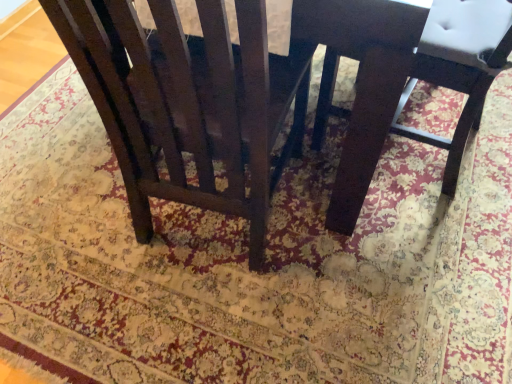
Question: From the image's perspective, is matte dark wood chair at center, marked as the first chair in a right-to-left arrangement, positioned above or below matte dark wood chair at center, positioned as the second chair in right-to-left order?

Choices:
 (A) above
 (B) below

Answer: (A)

Question: Considering the positions of point (345, 165) and point (136, 205), is point (345, 165) closer or farther from the camera than point (136, 205)?

Choices:
 (A) farther
 (B) closer

Answer: (B)

Question: Which object is positioned farthest from the dark wood chair at center?

Choices:
 (A) matte dark wood chair at center, marked as the 2th chair in a left-to-right arrangement
 (B) matte dark wood chair at center, positioned as the second chair in right-to-left order

Answer: (B)

Question: Which object is positioned closest to the dark wood chair at center?

Choices:
 (A) matte dark wood chair at center, marked as the first chair in a right-to-left arrangement
 (B) matte dark wood chair at center, the first chair in the left-to-right sequence

Answer: (A)